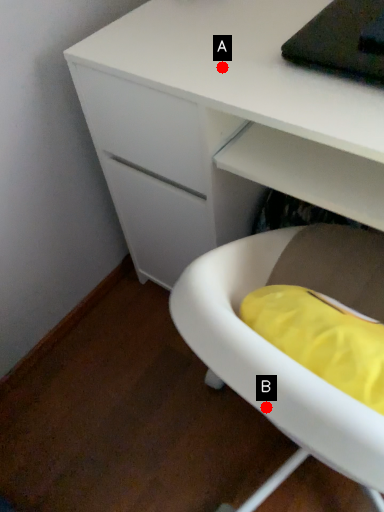
Question: Two points are circled on the image, labeled by A and B beside each circle. Which point is closer to the camera?

Choices:
 (A) A is closer
 (B) B is closer

Answer: (B)